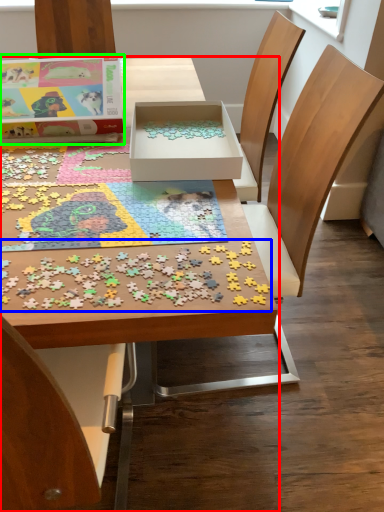
Question: Which object is positioned closest to table (highlighted by a red box)? Select from jigsaw puzzle (highlighted by a blue box) and box (highlighted by a green box).

Choices:
 (A) jigsaw puzzle
 (B) box

Answer: (A)